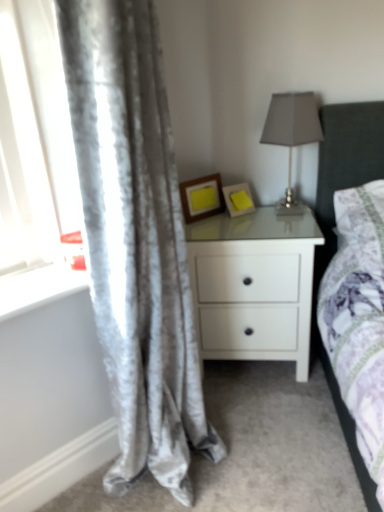
In order to click on vacant space to the right of yellow matte picture frame at center, placed as the 2th picture frame when sorted from right to left in this screenshot , I will do `click(240, 216)`.